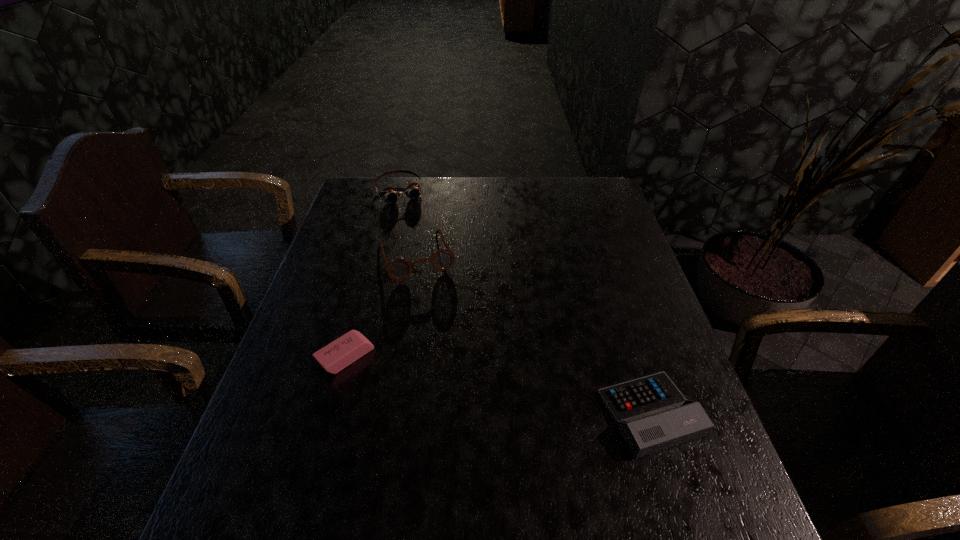
I want to click on vacant point that satisfies the following two spatial constraints: 1. on the back side of the tallest object; 2. on the right side of the eraser, so click(373, 256).